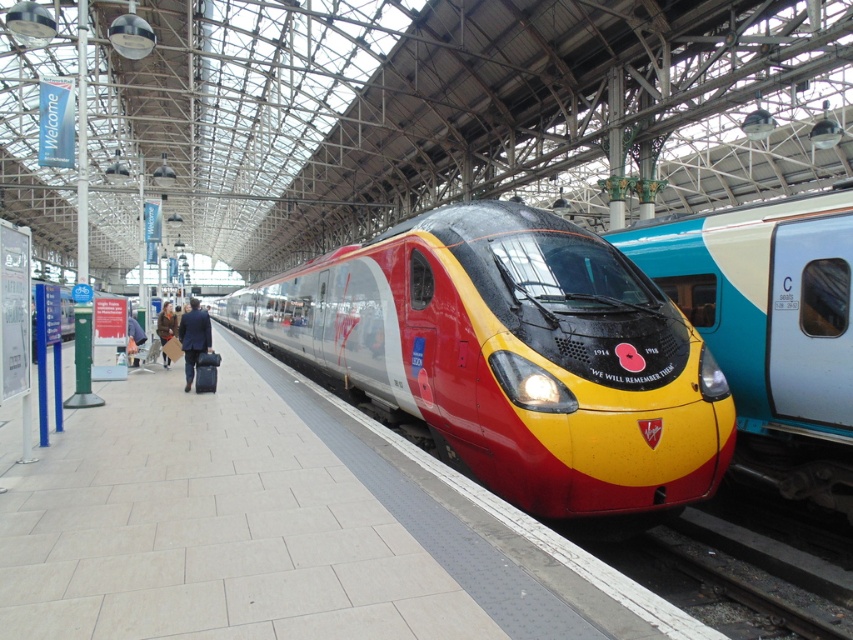
Does metallic silver train at center have a lesser width compared to dark blue suit at center?

Incorrect, metallic silver train at center's width is not less than dark blue suit at center's.

Does metallic silver train at center have a lesser height compared to dark blue suit at center?

In fact, metallic silver train at center may be taller than dark blue suit at center.

Is point (434, 410) positioned before point (198, 317)?

Yes, point (434, 410) is in front of point (198, 317).

The height and width of the screenshot is (640, 853). What are the coordinates of `metallic silver train at center` in the screenshot? It's located at (511, 356).

Is smooth concrete platform at center smaller than metallic silver train at center?

Yes.

Is point (154, 516) closer to viewer compared to point (479, 221)?

That is True.

Locate an element on the screen. smooth concrete platform at center is located at coordinates (281, 529).

The width and height of the screenshot is (853, 640). I want to click on smooth concrete platform at center, so click(x=281, y=529).

In the scene shown: Who is shorter, dark blue suit at center or leather jacket at left?

With less height is leather jacket at left.

Between point (190, 348) and point (126, 308), which one is positioned in front?

Point (190, 348) is in front.

Between point (198, 339) and point (132, 364), which one is positioned in front?

Point (198, 339)

I want to click on dark blue suit at center, so click(193, 337).